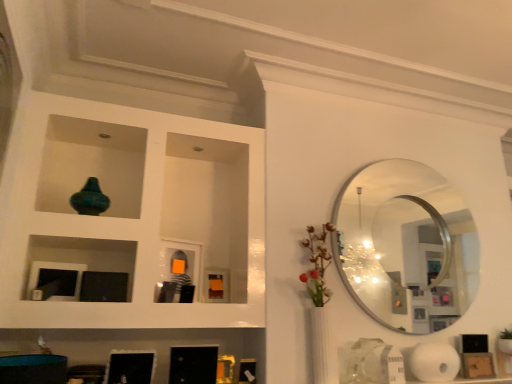
What is the approximate width of silver metallic mirror at upper right?

It is 2.44 inches.

The width and height of the screenshot is (512, 384). I want to click on white matte paper towel at lower right, so click(434, 362).

From a real-world perspective, is teal glass vase at upper left positioned above or below silver metallic mirror at upper right?

Clearly, from a real-world perspective, teal glass vase at upper left is above silver metallic mirror at upper right.

In the scene shown: Considering the sizes of objects teal glass vase at upper left and silver metallic mirror at upper right in the image provided, who is shorter, teal glass vase at upper left or silver metallic mirror at upper right?

teal glass vase at upper left.

The image size is (512, 384). What are the coordinates of `glass vase on the left of silver metallic mirror at upper right` in the screenshot? It's located at (90, 199).

Which object is positioned more to the left, teal glass vase at upper left or white matte paper towel at lower right?

teal glass vase at upper left.

Is teal glass vase at upper left turned away from white matte paper towel at lower right?

teal glass vase at upper left is not turned away from white matte paper towel at lower right.

Is teal glass vase at upper left wider than white matte paper towel at lower right?

Yes.

Are teal glass vase at upper left and white matte paper towel at lower right far apart?

Yes, teal glass vase at upper left and white matte paper towel at lower right are located far from each other.

Which object is positioned more to the left, white matte paper towel at lower right or silver metallic mirror at upper right?

silver metallic mirror at upper right.

From the image's perspective, which is below, white matte paper towel at lower right or silver metallic mirror at upper right?

white matte paper towel at lower right is shown below in the image.

Could silver metallic mirror at upper right be considered to be inside white matte paper towel at lower right?

No, white matte paper towel at lower right does not contain silver metallic mirror at upper right.

Considering the positions of points (411, 356) and (379, 291), is point (411, 356) closer to camera compared to point (379, 291)?

That is True.

From the image's perspective, is silver metallic mirror at upper right under white matte paper towel at lower right?

No, from the image's perspective, silver metallic mirror at upper right is not below white matte paper towel at lower right.

From a real-world perspective, is silver metallic mirror at upper right under white matte paper towel at lower right?

No.

Is silver metallic mirror at upper right closer to the viewer compared to white matte paper towel at lower right?

No, it is behind white matte paper towel at lower right.

Choose the correct answer: Is silver metallic mirror at upper right inside white matte paper towel at lower right or outside it?

silver metallic mirror at upper right cannot be found inside white matte paper towel at lower right.

Can you tell me how much white matte paper towel at lower right and teal glass vase at upper left differ in facing direction?

The angular difference between white matte paper towel at lower right and teal glass vase at upper left is 2.16 degrees.

Looking at this image, measure the distance between white matte paper towel at lower right and teal glass vase at upper left.

white matte paper towel at lower right and teal glass vase at upper left are 1.99 meters apart from each other.

Can you confirm if white matte paper towel at lower right is thinner than teal glass vase at upper left?

Correct, the width of white matte paper towel at lower right is less than that of teal glass vase at upper left.

From a real-world perspective, who is located higher, white matte paper towel at lower right or teal glass vase at upper left?

From a 3D spatial view, teal glass vase at upper left is above.

From their relative heights in the image, would you say silver metallic mirror at upper right is taller or shorter than teal glass vase at upper left?

Result: Considering their sizes, silver metallic mirror at upper right has more height than teal glass vase at upper left.

What's the angular difference between silver metallic mirror at upper right and teal glass vase at upper left's facing directions?

The angle between the facing direction of silver metallic mirror at upper right and the facing direction of teal glass vase at upper left is 5.56 degrees.

Which of these two, silver metallic mirror at upper right or teal glass vase at upper left, is smaller?

teal glass vase at upper left is smaller.

What are the coordinates of `mirror on the right of teal glass vase at upper left` in the screenshot? It's located at pos(406,246).

Where is `paper towel located below the teal glass vase at upper left (from the image's perspective)`? paper towel located below the teal glass vase at upper left (from the image's perspective) is located at coordinates (434, 362).

Which object lies nearer to the anchor point white matte paper towel at lower right, silver metallic mirror at upper right or teal glass vase at upper left?

Based on the image, silver metallic mirror at upper right appears to be nearer to white matte paper towel at lower right.

Looking at the image, which one is located closer to silver metallic mirror at upper right, white matte paper towel at lower right or teal glass vase at upper left?

Among the two, white matte paper towel at lower right is located nearer to silver metallic mirror at upper right.

When comparing their distances from silver metallic mirror at upper right, does teal glass vase at upper left or white matte paper towel at lower right seem closer?

white matte paper towel at lower right lies closer to silver metallic mirror at upper right than the other object.

From the picture: When comparing their distances from teal glass vase at upper left, does white matte paper towel at lower right or silver metallic mirror at upper right seem further?

Based on the image, white matte paper towel at lower right appears to be further to teal glass vase at upper left.

Estimate the real-world distances between objects in this image. Which object is closer to teal glass vase at upper left, silver metallic mirror at upper right or white matte paper towel at lower right?

silver metallic mirror at upper right is positioned closer to the anchor teal glass vase at upper left.

Considering their positions, is teal glass vase at upper left positioned further to white matte paper towel at lower right than silver metallic mirror at upper right?

The object further to white matte paper towel at lower right is teal glass vase at upper left.

What are the coordinates of `mirror between teal glass vase at upper left and white matte paper towel at lower right` in the screenshot? It's located at pyautogui.click(x=406, y=246).